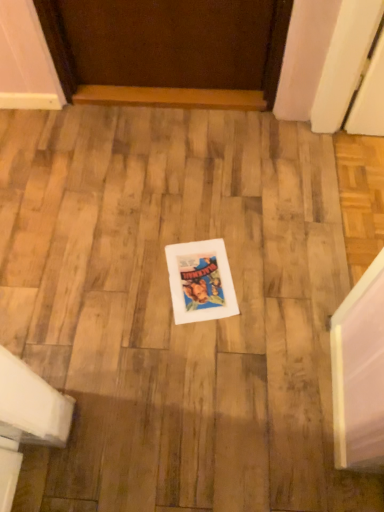
I want to click on vacant location below matte paper comic book at center (from a real-world perspective), so click(x=204, y=279).